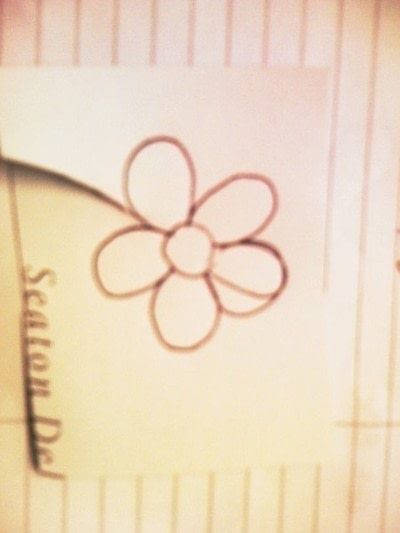
Locate an element on the screen. Image resolution: width=400 pixels, height=533 pixels. blank space below flower drawing is located at coordinates (185, 391).